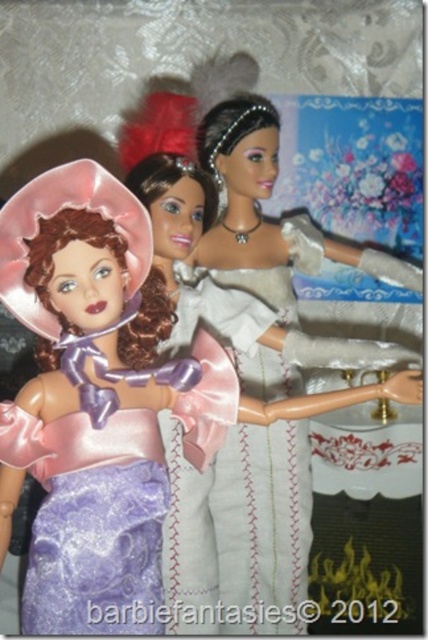
Question: Among these objects, which one is nearest to the camera?

Choices:
 (A) matte silver dress at center
 (B) lavender satin dress at left

Answer: (B)

Question: Is lavender satin dress at left to the left of matte silver dress at center from the viewer's perspective?

Choices:
 (A) no
 (B) yes

Answer: (B)

Question: Is lavender satin dress at left closer to camera compared to matte silver dress at center?

Choices:
 (A) no
 (B) yes

Answer: (B)

Question: Which point is closer to the camera?

Choices:
 (A) lavender satin dress at left
 (B) matte silver dress at center

Answer: (A)

Question: Can you confirm if lavender satin dress at left is positioned to the left of matte silver dress at center?

Choices:
 (A) yes
 (B) no

Answer: (A)